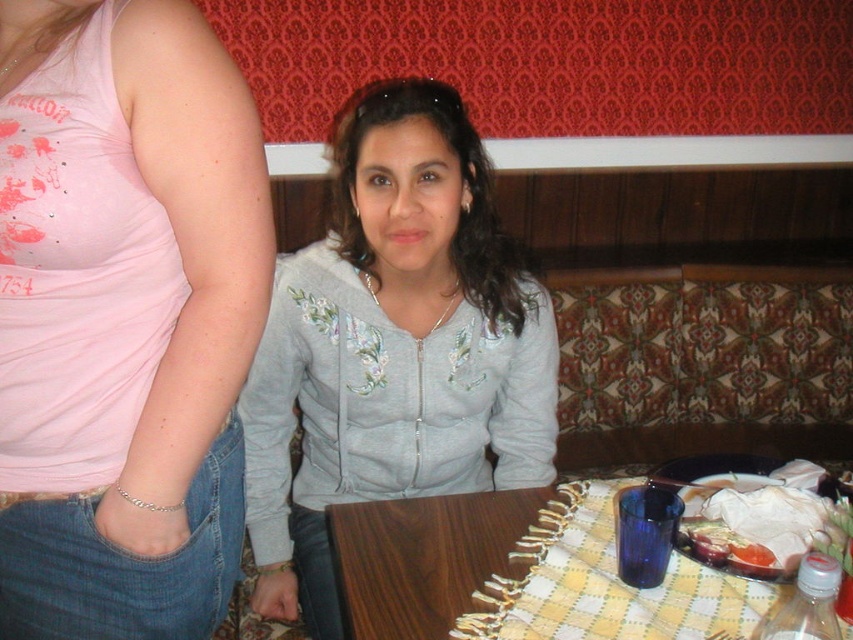
Between point (202, 608) and point (364, 518), which one is positioned behind?

The point (364, 518) is more distant.

Does matte gray hoodie at center appear under wooden table at lower center?

No.

The image size is (853, 640). In order to click on matte gray hoodie at center in this screenshot , I will do `click(126, 321)`.

The image size is (853, 640). Find the location of `matte gray hoodie at center`. matte gray hoodie at center is located at coordinates (126, 321).

Who is lower down, gray fleece jacket at center or translucent plastic cup at table right?

Positioned lower is translucent plastic cup at table right.

Between gray fleece jacket at center and translucent plastic cup at table right, which one has more height?

With more height is gray fleece jacket at center.

Is point (366, 166) more distant than point (827, 483)?

Yes, point (366, 166) is behind point (827, 483).

Identify the location of gray fleece jacket at center. (393, 346).

Is matte gray hoodie at center positioned at the back of translucent plastic cup at table right?

No, matte gray hoodie at center is in front of translucent plastic cup at table right.

Can you confirm if matte gray hoodie at center is thinner than translucent plastic cup at table right?

Correct, matte gray hoodie at center's width is less than translucent plastic cup at table right's.

The height and width of the screenshot is (640, 853). What do you see at coordinates (126, 321) in the screenshot?
I see `matte gray hoodie at center` at bounding box center [126, 321].

You are a GUI agent. You are given a task and a screenshot of the screen. Output one action in this format:
    pyautogui.click(x=<x>, y=<y>)
    Task: Click on the matte gray hoodie at center
    Image resolution: width=853 pixels, height=640 pixels.
    Given the screenshot: What is the action you would take?
    [126, 321]